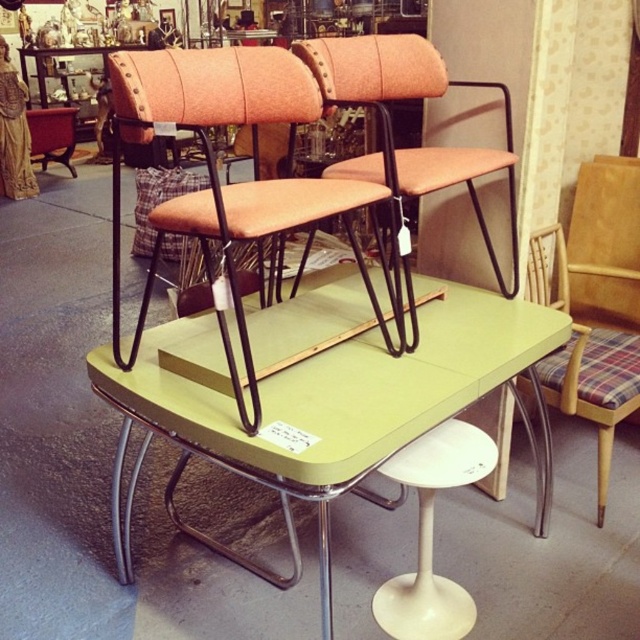
Question: Which point is farther to the camera?

Choices:
 (A) (392, 612)
 (B) (280, 484)

Answer: (A)

Question: Is green laminate table at center below white plastic stool at lower center?

Choices:
 (A) yes
 (B) no

Answer: (B)

Question: Which object is farther from the camera taking this photo?

Choices:
 (A) white plastic stool at lower center
 (B) green laminate table at center
 (C) plaid fabric folding chair at right

Answer: (C)

Question: Does orange fabric chair at center appear on the right side of plaid fabric folding chair at right?

Choices:
 (A) yes
 (B) no

Answer: (B)

Question: Which point is farther to the camera?

Choices:
 (A) plaid fabric folding chair at right
 (B) green laminate table at center

Answer: (A)

Question: Does plaid fabric folding chair at right appear on the right side of white plastic stool at lower center?

Choices:
 (A) no
 (B) yes

Answer: (B)